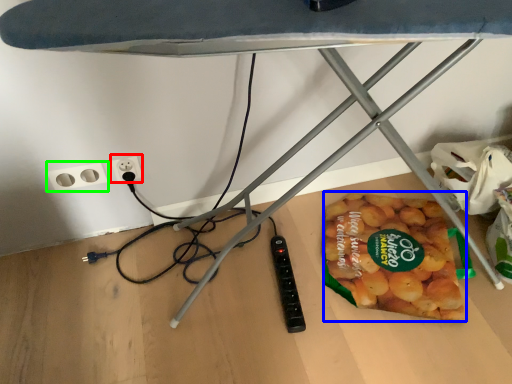
Question: Which object is positioned farthest from electric outlet (highlighted by a red box)? Select from snack (highlighted by a blue box) and socket (highlighted by a green box).

Choices:
 (A) snack
 (B) socket

Answer: (A)